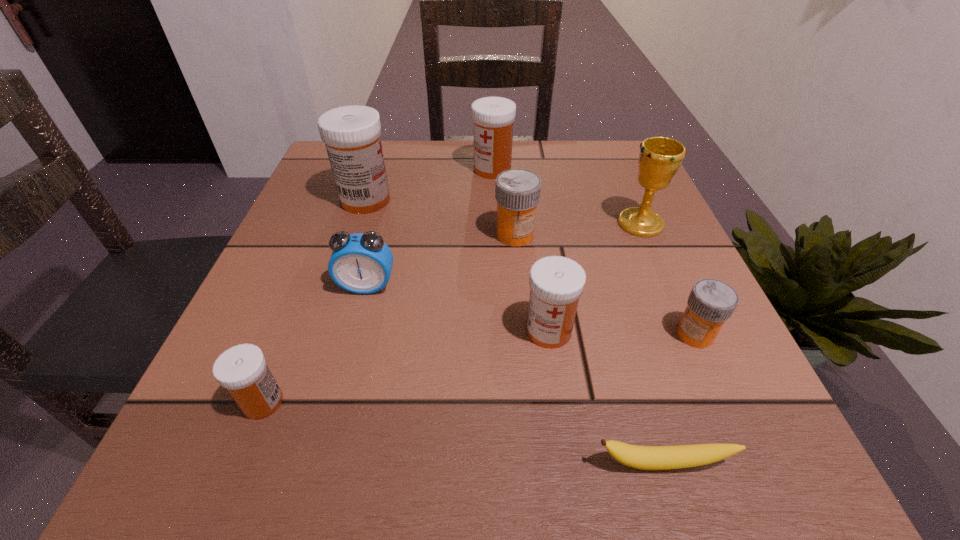
This screenshot has width=960, height=540. What are the coordinates of `vacant area located on the face of the fifth farthest object` in the screenshot? It's located at (350, 350).

The height and width of the screenshot is (540, 960). I want to click on free space located on the label side of the nearer orange medicine, so click(517, 334).

Where is `vacant region located 0.300m on the label side of the nearer orange medicine`? The height and width of the screenshot is (540, 960). vacant region located 0.300m on the label side of the nearer orange medicine is located at coordinates (478, 334).

Identify the location of free space located on the label side of the nearer orange medicine. (538, 334).

Where is `free space located on the back of the nearest white medicine`? The image size is (960, 540). free space located on the back of the nearest white medicine is located at coordinates (x=303, y=299).

Where is `object that is at the near edge`? The image size is (960, 540). object that is at the near edge is located at coordinates (639, 457).

Find the location of a particular element. The image size is (960, 540). alarm clock present at the left edge is located at coordinates (360, 263).

Locate an element on the screen. The width and height of the screenshot is (960, 540). chalice present at the right edge is located at coordinates (660, 158).

Locate an element on the screen. The height and width of the screenshot is (540, 960). medicine situated at the right edge is located at coordinates (711, 302).

The image size is (960, 540). I want to click on banana that is at the right edge, so click(x=639, y=457).